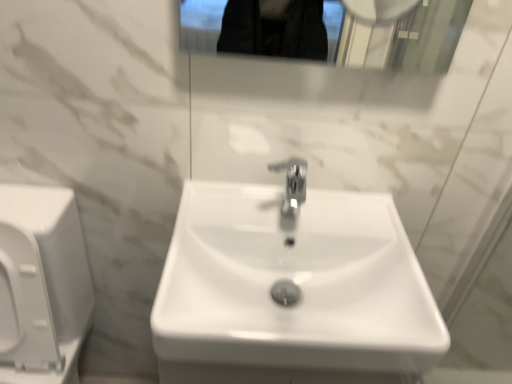
The image size is (512, 384). In order to click on white glossy sink at center in this screenshot , I will do `click(292, 288)`.

The width and height of the screenshot is (512, 384). What do you see at coordinates (292, 288) in the screenshot?
I see `white glossy sink at center` at bounding box center [292, 288].

At what (x,y) coordinates should I click in order to perform the action: click on white glossy toilet at left. Please return your answer as a coordinate pair (x, y). Looking at the image, I should click on (42, 285).

Measure the distance between white glossy toilet at left and camera.

34.57 inches.

What do you see at coordinates (42, 285) in the screenshot?
I see `white glossy toilet at left` at bounding box center [42, 285].

Where is `white glossy sink at center`? white glossy sink at center is located at coordinates (292, 288).

Is white glossy toilet at left to the left or to the right of white glossy sink at center in the image?

Based on their positions, white glossy toilet at left is located to the left of white glossy sink at center.

Is white glossy toilet at left closer to the viewer compared to white glossy sink at center?

That is True.

Which is nearer, (6, 253) or (200, 261)?

Positioned in front is point (200, 261).

From the image's perspective, is white glossy toilet at left under white glossy sink at center?

Yes, from the image's perspective, white glossy toilet at left is below white glossy sink at center.

From a real-world perspective, is white glossy toilet at left above or below white glossy sink at center?

white glossy toilet at left is below white glossy sink at center.

Which of these two, white glossy toilet at left or white glossy sink at center, is thinner?

Thinner between the two is white glossy sink at center.

Between white glossy toilet at left and white glossy sink at center, which one has more height?

With more height is white glossy toilet at left.

Which of these two, white glossy toilet at left or white glossy sink at center, is bigger?

white glossy toilet at left is bigger.

Would you say white glossy toilet at left is outside white glossy sink at center?

Absolutely, white glossy toilet at left is external to white glossy sink at center.

Is white glossy toilet at left positioned far away from white glossy sink at center?

white glossy toilet at left is actually quite close to white glossy sink at center.

Could you tell me if white glossy toilet at left is facing white glossy sink at center?

No, white glossy toilet at left is not aimed at white glossy sink at center.

How far apart are white glossy toilet at left and white glossy sink at center?

white glossy toilet at left is 19.38 inches away from white glossy sink at center.

Where is `sink above the white glossy toilet at left (from the image's perspective)`? The width and height of the screenshot is (512, 384). sink above the white glossy toilet at left (from the image's perspective) is located at coordinates (x=292, y=288).

In the scene shown: Considering the positions of objects white glossy sink at center and white glossy toilet at left in the image provided, who is more to the right, white glossy sink at center or white glossy toilet at left?

white glossy sink at center.

Considering the positions of objects white glossy sink at center and white glossy toilet at left in the image provided, who is behind, white glossy sink at center or white glossy toilet at left?

white glossy sink at center is behind.

Is point (273, 349) closer to viewer compared to point (7, 368)?

Yes, point (273, 349) is in front of point (7, 368).

From the image's perspective, is white glossy sink at center on white glossy toilet at left?

Yes.

From a real-world perspective, is white glossy sink at center located beneath white glossy toilet at left?

No, from a real-world perspective, white glossy sink at center is not below white glossy toilet at left.

Does white glossy sink at center have a greater width compared to white glossy toilet at left?

Incorrect, the width of white glossy sink at center does not surpass that of white glossy toilet at left.

Is white glossy sink at center shorter than white glossy toilet at left?

Yes, white glossy sink at center is shorter than white glossy toilet at left.

Between white glossy sink at center and white glossy toilet at left, which one has smaller size?

With smaller size is white glossy sink at center.

Based on the photo, would you say white glossy sink at center is inside or outside white glossy toilet at left?

white glossy sink at center exists outside the volume of white glossy toilet at left.

Is white glossy sink at center with white glossy toilet at left?

No, white glossy sink at center is not touching white glossy toilet at left.

Is white glossy sink at center oriented away from white glossy toilet at left?

white glossy sink at center is not turned away from white glossy toilet at left.

How different are the orientations of white glossy sink at center and white glossy toilet at left in degrees?

The angle between the facing direction of white glossy sink at center and the facing direction of white glossy toilet at left is 0.472 degrees.

In order to click on porcelain in front of the white glossy sink at center in this screenshot , I will do `click(42, 285)`.

I want to click on sink that appears above the white glossy toilet at left (from a real-world perspective), so click(292, 288).

This screenshot has height=384, width=512. I want to click on porcelain to the left of white glossy sink at center, so [x=42, y=285].